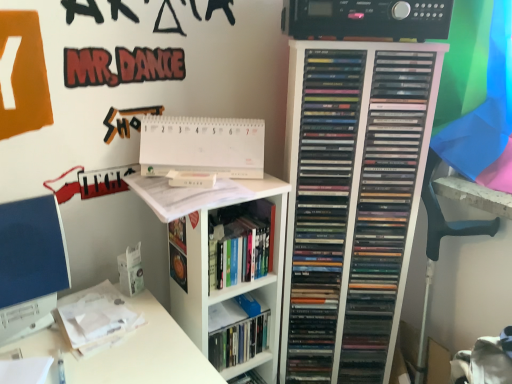
Describe the element at coordinates (439, 243) in the screenshot. I see `black plastic swivel chair at right` at that location.

Describe the element at coordinates (202, 146) in the screenshot. I see `white paper at upper center, the 1th paperback book when ordered from top to bottom` at that location.

Locate an element on the screen. This screenshot has width=512, height=384. white paper at upper center, the 2th paperback book when ordered from bottom to top is located at coordinates point(202,146).

The height and width of the screenshot is (384, 512). What do you see at coordinates (243, 252) in the screenshot?
I see `hardcover book at center` at bounding box center [243, 252].

Describe the element at coordinates (208, 262) in the screenshot. Image resolution: width=512 pixels, height=384 pixels. I see `white glossy bookshelf at upper center` at that location.

What do you see at coordinates (30, 265) in the screenshot?
I see `blue matte computer monitor at left` at bounding box center [30, 265].

Find the location of a particular element. black plastic swivel chair at right is located at coordinates (439, 243).

From the image's perspective, is white matte paperback book at center, which is the 1th paperback book from bottom to top, on hardcover book at center?

Yes, from the image's perspective, white matte paperback book at center, which is the 1th paperback book from bottom to top, is over hardcover book at center.

Considering the relative sizes of white matte paperback book at center, which is the second paperback book from top to bottom, and hardcover book at center in the image provided, is white matte paperback book at center, which is the second paperback book from top to bottom, wider than hardcover book at center?

Incorrect, the width of white matte paperback book at center, which is the second paperback book from top to bottom, does not surpass that of hardcover book at center.

Considering the relative positions of white matte paperback book at center, which is the second paperback book from top to bottom, and hardcover book at center in the image provided, is white matte paperback book at center, which is the second paperback book from top to bottom, in front of hardcover book at center?

No, white matte paperback book at center, which is the second paperback book from top to bottom, is further to the viewer.

Is white matte paperback book at center, which is the second paperback book from top to bottom, completely or partially outside of hardcover book at center?

white matte paperback book at center, which is the second paperback book from top to bottom, lies outside hardcover book at center's area.

Are white glossy bookshelf at upper center and black plastic stereo at upper center located far from each other?

Actually, white glossy bookshelf at upper center and black plastic stereo at upper center are a little close together.

Which point is more forward, (181,203) or (381,31)?

Positioned in front is point (381,31).

From the image's perspective, is white glossy bookshelf at upper center on top of black plastic stereo at upper center?

No, from the image's perspective, white glossy bookshelf at upper center is not on top of black plastic stereo at upper center.

Which object is further away from the camera taking this photo, white glossy bookshelf at upper center or black plastic stereo at upper center?

white glossy bookshelf at upper center.

Can we say white paper at upper center, the 1th paperback book when ordered from top to bottom, lies outside white matte paperback book at center, which is the second paperback book from top to bottom?

Indeed, white paper at upper center, the 1th paperback book when ordered from top to bottom, is completely outside white matte paperback book at center, which is the second paperback book from top to bottom.

Between white paper at upper center, the 2th paperback book when ordered from bottom to top, and white matte paperback book at center, which is the 1th paperback book from bottom to top, which one appears on the left side from the viewer's perspective?

From the viewer's perspective, white matte paperback book at center, which is the 1th paperback book from bottom to top, appears more on the left side.

What's the angular difference between white paper at upper center, the 2th paperback book when ordered from bottom to top, and white matte paperback book at center, which is the second paperback book from top to bottom,'s facing directions?

The angle between the facing direction of white paper at upper center, the 2th paperback book when ordered from bottom to top, and the facing direction of white matte paperback book at center, which is the second paperback book from top to bottom, is 0.000654 degrees.

Is white paper at upper center, the 2th paperback book when ordered from bottom to top, placed right next to white matte paperback book at center, which is the second paperback book from top to bottom?

Yes, white paper at upper center, the 2th paperback book when ordered from bottom to top, is beside white matte paperback book at center, which is the second paperback book from top to bottom.

Is white glossy bookshelf at upper center positioned beyond the bounds of white paper at upper center, the 1th paperback book when ordered from top to bottom?

Indeed, white glossy bookshelf at upper center is completely outside white paper at upper center, the 1th paperback book when ordered from top to bottom.

Considering the positions of objects white glossy bookshelf at upper center and white paper at upper center, the 2th paperback book when ordered from bottom to top, in the image provided, who is more to the left, white glossy bookshelf at upper center or white paper at upper center, the 2th paperback book when ordered from bottom to top,?

white paper at upper center, the 2th paperback book when ordered from bottom to top, is more to the left.

Which is behind, point (273, 377) or point (177, 157)?

The point (273, 377) is farther.

How many degrees apart are the facing directions of white glossy bookshelf at upper center and black plastic swivel chair at right?

The angle between the facing direction of white glossy bookshelf at upper center and the facing direction of black plastic swivel chair at right is 90.6 degrees.

Are white glossy bookshelf at upper center and black plastic swivel chair at right beside each other?

There is a gap between white glossy bookshelf at upper center and black plastic swivel chair at right.

Consider the image. Considering their positions, is white glossy bookshelf at upper center located in front of or behind black plastic swivel chair at right?

white glossy bookshelf at upper center is positioned closer to the viewer than black plastic swivel chair at right.

Is white glossy bookshelf at upper center shorter than black plastic swivel chair at right?

Incorrect, the height of white glossy bookshelf at upper center does not fall short of that of black plastic swivel chair at right.

From the image's perspective, is white matte paperback book at center, which is the second paperback book from top to bottom, located above black plastic stereo at upper center?

No, from the image's perspective, white matte paperback book at center, which is the second paperback book from top to bottom, is not over black plastic stereo at upper center.

Is white matte paperback book at center, which is the 1th paperback book from bottom to top, oriented towards black plastic stereo at upper center?

No, white matte paperback book at center, which is the 1th paperback book from bottom to top, is not turned towards black plastic stereo at upper center.

How many degrees apart are the facing directions of white matte paperback book at center, which is the second paperback book from top to bottom, and black plastic stereo at upper center?

There is a 2.56-degree angle between the facing directions of white matte paperback book at center, which is the second paperback book from top to bottom, and black plastic stereo at upper center.

From a real-world perspective, is white matte paperback book at center, which is the second paperback book from top to bottom, physically below black plastic stereo at upper center?

Yes, from a real-world perspective, white matte paperback book at center, which is the second paperback book from top to bottom, is beneath black plastic stereo at upper center.

Is white glossy bookshelf at upper center facing away from blue matte computer monitor at left?

white glossy bookshelf at upper center does not have its back to blue matte computer monitor at left.

Which object is more forward, white glossy bookshelf at upper center or blue matte computer monitor at left?

blue matte computer monitor at left is closer to the camera.

Which is more distant, (x=150, y=189) or (x=37, y=309)?

The point (x=150, y=189) is farther from the camera.

Is white glossy bookshelf at upper center surrounding blue matte computer monitor at left?

No, blue matte computer monitor at left is not inside white glossy bookshelf at upper center.

You are a GUI agent. You are given a task and a screenshot of the screen. Output one action in this format:
    pyautogui.click(x=<x>, y=<y>)
    Task: Click on the book below the white matte paperback book at center, which is the second paperback book from top to bottom (from the image's perspective)
    This screenshot has width=512, height=384.
    Given the screenshot: What is the action you would take?
    pyautogui.click(x=243, y=252)

Find the location of a particular element. The width and height of the screenshot is (512, 384). shelf on the left of black plastic stereo at upper center is located at coordinates 208,262.

Based on their spatial positions, is black plastic swivel chair at right or blue matte computer monitor at left further from white glossy bookshelf at upper center?

black plastic swivel chair at right is further to white glossy bookshelf at upper center.

Estimate the real-world distances between objects in this image. Which object is closer to black plastic swivel chair at right, hardcover book at center or white matte paperback book at center, which is the second paperback book from top to bottom?

Among the two, hardcover book at center is located nearer to black plastic swivel chair at right.

Looking at the image, which one is located further to white matte paperback book at center, which is the 1th paperback book from bottom to top, black plastic stereo at upper center or black plastic swivel chair at right?

black plastic swivel chair at right is further to white matte paperback book at center, which is the 1th paperback book from bottom to top.

Which object lies further to the anchor point white matte paperback book at center, which is the 1th paperback book from bottom to top, white paper at upper center, the 2th paperback book when ordered from bottom to top, or blue matte computer monitor at left?

The object further to white matte paperback book at center, which is the 1th paperback book from bottom to top, is blue matte computer monitor at left.

Looking at the image, which one is located further to white paper at upper center, the 1th paperback book when ordered from top to bottom, white matte paperback book at center, which is the second paperback book from top to bottom, or black plastic stereo at upper center?

black plastic stereo at upper center.

Considering their positions, is white paper at upper center, the 1th paperback book when ordered from top to bottom, positioned closer to white matte paperback book at center, which is the 1th paperback book from bottom to top, than hardcover book at center?

white paper at upper center, the 1th paperback book when ordered from top to bottom, lies closer to white matte paperback book at center, which is the 1th paperback book from bottom to top, than the other object.

Based on their spatial positions, is white paper at upper center, the 1th paperback book when ordered from top to bottom, or hardcover book at center closer to white glossy bookshelf at upper center?

Among the two, hardcover book at center is located nearer to white glossy bookshelf at upper center.

Considering their positions, is white matte paperback book at center, which is the 1th paperback book from bottom to top, positioned closer to white glossy bookshelf at upper center than black plastic swivel chair at right?

The object closer to white glossy bookshelf at upper center is white matte paperback book at center, which is the 1th paperback book from bottom to top.

Where is `stereo located between blue matte computer monitor at left and black plastic swivel chair at right in the left-right direction`? The image size is (512, 384). stereo located between blue matte computer monitor at left and black plastic swivel chair at right in the left-right direction is located at coordinates (366, 19).

Image resolution: width=512 pixels, height=384 pixels. Find the location of `computer monitor between black plastic stereo at upper center and white glossy bookshelf at upper center in the up-down direction`. computer monitor between black plastic stereo at upper center and white glossy bookshelf at upper center in the up-down direction is located at coordinates (30, 265).

I want to click on book between black plastic stereo at upper center and black plastic swivel chair at right from top to bottom, so point(243,252).

At what (x,y) coordinates should I click in order to perform the action: click on paperback book between blue matte computer monitor at left and white paper at upper center, the 2th paperback book when ordered from bottom to top, in the horizontal direction. Please return your answer as a coordinate pair (x, y). This screenshot has width=512, height=384. Looking at the image, I should click on (191, 179).